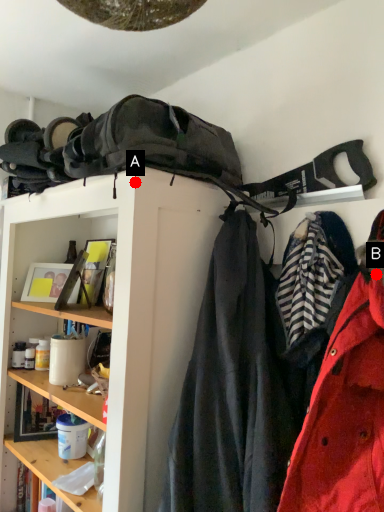
Question: Two points are circled on the image, labeled by A and B beside each circle. Among these points, which one is nearest to the camera?

Choices:
 (A) A is closer
 (B) B is closer

Answer: (B)